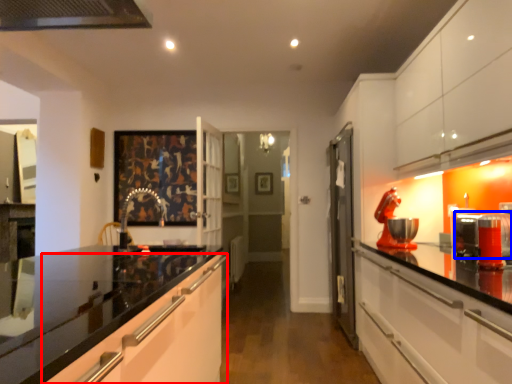
Question: Which point is closer to the camera, cabinetry (highlighted by a red box) or appliance (highlighted by a blue box)?

Choices:
 (A) cabinetry
 (B) appliance

Answer: (A)